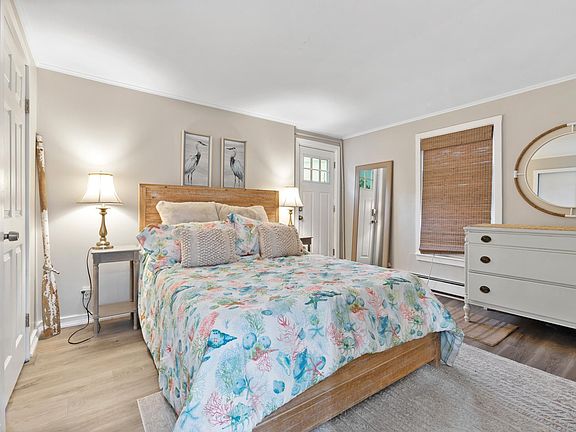
Where is `mirror`? This screenshot has height=432, width=576. mirror is located at coordinates (553, 172), (377, 195), (371, 223), (560, 188).